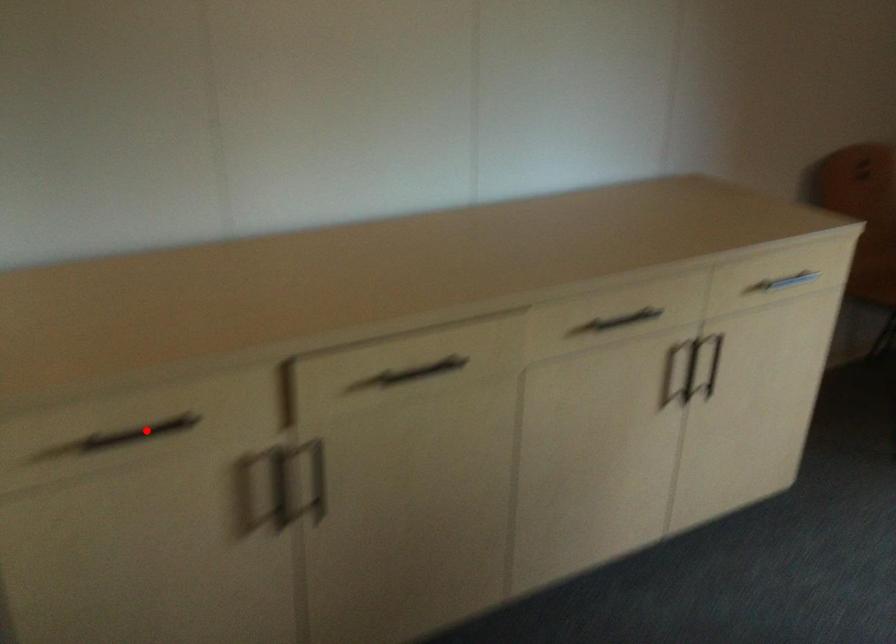
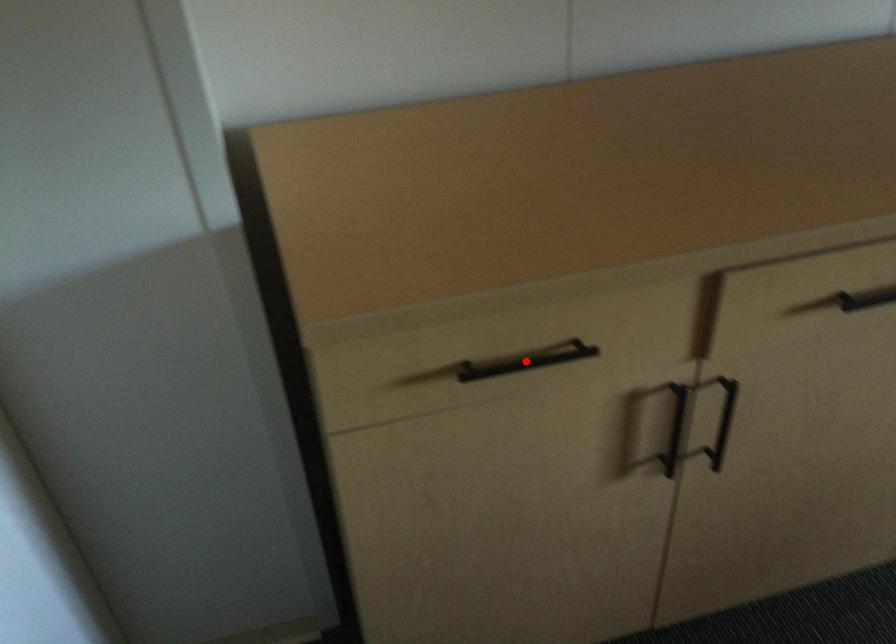
I am providing you with two images of the same scene from different viewpoints. A red point is marked on the first image and another point is marked on the second image. Do the highlighted points in image1 and image2 indicate the same real-world spot?

Yes